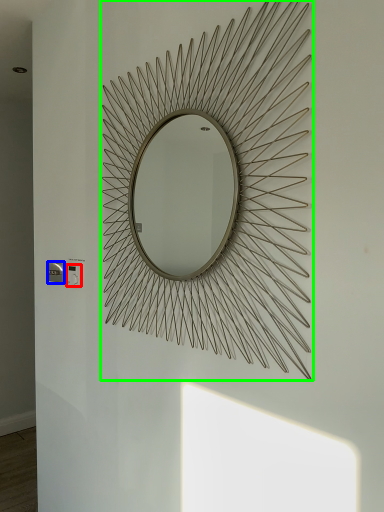
Question: Estimate the real-world distances between objects in this image. Which object is closer to electric outlet (highlighted by a red box), electric outlet (highlighted by a blue box) or mirror (highlighted by a green box)?

Choices:
 (A) electric outlet
 (B) mirror

Answer: (A)